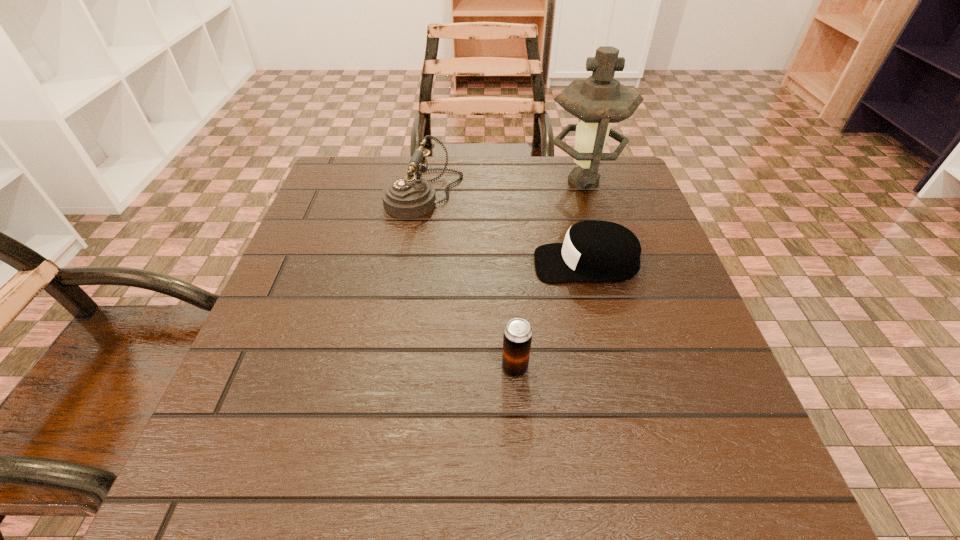
The image size is (960, 540). Identify the location of oil lamp. (599, 100).

Identify the location of the second tallest object. (408, 197).

Find the location of `the leftmost object`. the leftmost object is located at coordinates (408, 197).

Image resolution: width=960 pixels, height=540 pixels. In order to click on the second object from left to right in this screenshot , I will do `click(517, 337)`.

The height and width of the screenshot is (540, 960). I want to click on the nearest object, so click(x=517, y=337).

Locate an element on the screen. The image size is (960, 540). cap is located at coordinates (597, 251).

Where is `the second nearest object`? This screenshot has width=960, height=540. the second nearest object is located at coordinates (597, 251).

This screenshot has width=960, height=540. Find the location of `vacant area situated on the left of the oil lamp`. vacant area situated on the left of the oil lamp is located at coordinates (516, 181).

Find the location of a particular element. This screenshot has height=540, width=960. free point located on the left of the telephone is located at coordinates (336, 195).

This screenshot has width=960, height=540. I want to click on free location located 0.150m on the left of the second object from left to right, so click(x=410, y=367).